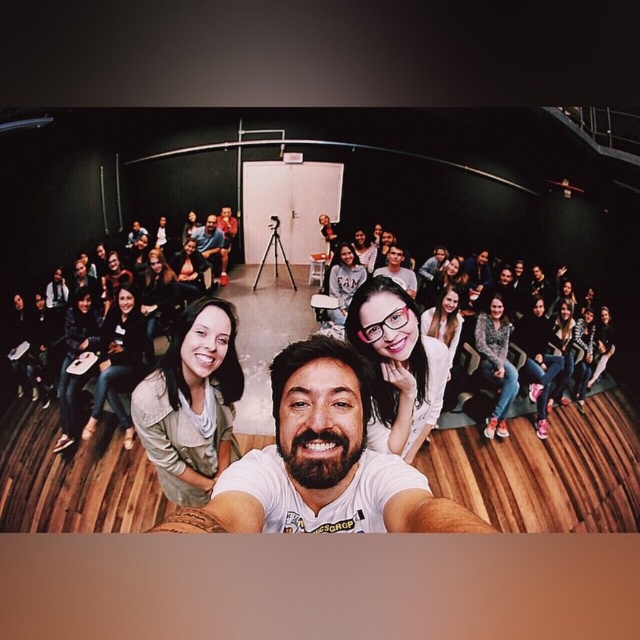
You are standing in the studio and want to touch the point at coordinates (321,461). Which object in the image does this point correspond to?

The point at coordinates (321,461) corresponds to the white matte t shirt at center.